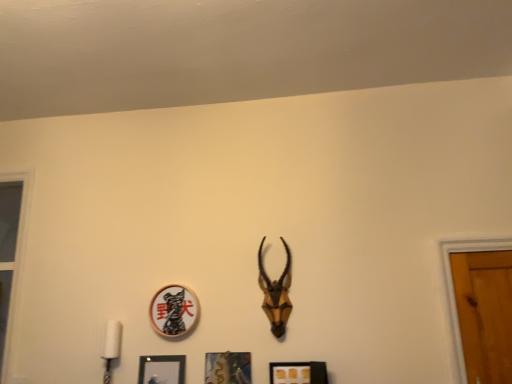
Question: Which direction should I rotate to face metallic silver picture frame at center, marked as the 2th picture frame in a right-to-left arrangement, — up or down?

Choices:
 (A) down
 (B) up

Answer: (A)

Question: Is wooden circle at center, arranged as the second picture frame when viewed from the left, completely or partially outside of brown matte antelope head at center?

Choices:
 (A) yes
 (B) no

Answer: (A)

Question: Is wooden circle at center, acting as the 3th picture frame starting from the right, taller than brown matte antelope head at center?

Choices:
 (A) yes
 (B) no

Answer: (B)

Question: From the image's perspective, does wooden circle at center, acting as the 3th picture frame starting from the right, appear lower than brown matte antelope head at center?

Choices:
 (A) yes
 (B) no

Answer: (A)

Question: From the image's perspective, does wooden circle at center, arranged as the second picture frame when viewed from the left, appear higher than brown matte antelope head at center?

Choices:
 (A) no
 (B) yes

Answer: (A)

Question: Considering the relative sizes of wooden circle at center, acting as the 3th picture frame starting from the right, and brown matte antelope head at center in the image provided, is wooden circle at center, acting as the 3th picture frame starting from the right, thinner than brown matte antelope head at center?

Choices:
 (A) yes
 (B) no

Answer: (A)

Question: Is the position of wooden circle at center, arranged as the second picture frame when viewed from the left, less distant than that of brown matte antelope head at center?

Choices:
 (A) yes
 (B) no

Answer: (B)

Question: Is matte gold picture frame at lower center, the first picture frame in the right-to-left sequence, wider than brown matte antelope head at center?

Choices:
 (A) yes
 (B) no

Answer: (B)

Question: Does matte gold picture frame at lower center, which appears as the 4th picture frame when viewed from the left, lie in front of brown matte antelope head at center?

Choices:
 (A) no
 (B) yes

Answer: (B)

Question: Considering the relative sizes of matte gold picture frame at lower center, the first picture frame in the right-to-left sequence, and brown matte antelope head at center in the image provided, is matte gold picture frame at lower center, the first picture frame in the right-to-left sequence, bigger than brown matte antelope head at center?

Choices:
 (A) yes
 (B) no

Answer: (B)

Question: Can you confirm if matte gold picture frame at lower center, the first picture frame in the right-to-left sequence, is smaller than brown matte antelope head at center?

Choices:
 (A) yes
 (B) no

Answer: (A)

Question: From a real-world perspective, is matte gold picture frame at lower center, the first picture frame in the right-to-left sequence, positioned over brown matte antelope head at center based on gravity?

Choices:
 (A) yes
 (B) no

Answer: (B)

Question: From the image's perspective, is matte gold picture frame at lower center, the first picture frame in the right-to-left sequence, over brown matte antelope head at center?

Choices:
 (A) yes
 (B) no

Answer: (B)

Question: Is metallic silver picture frame at center, marked as the 2th picture frame in a right-to-left arrangement, turned away from matte gold picture frame at lower center, which appears as the 4th picture frame when viewed from the left?

Choices:
 (A) no
 (B) yes

Answer: (A)